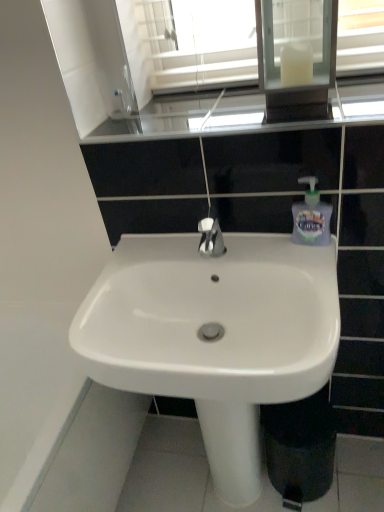
Identify the location of free region on the left part of white glass medicine cabinet at upper center. The image size is (384, 512). (219, 106).